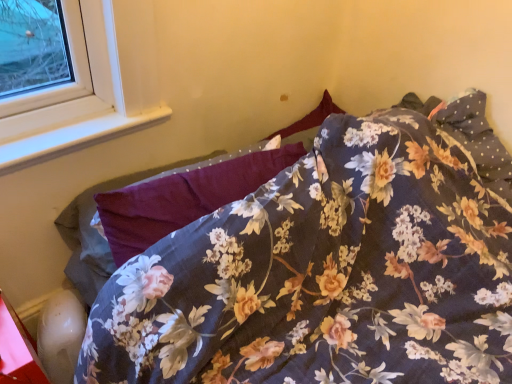
Question: Is white plastic window sill at upper left taller than floral fabric pillow at center?

Choices:
 (A) no
 (B) yes

Answer: (A)

Question: Does white plastic window sill at upper left have a larger size compared to floral fabric pillow at center?

Choices:
 (A) yes
 (B) no

Answer: (B)

Question: From the image's perspective, is white plastic window sill at upper left located above floral fabric pillow at center?

Choices:
 (A) no
 (B) yes

Answer: (B)

Question: Considering the relative positions of white plastic window sill at upper left and floral fabric pillow at center in the image provided, is white plastic window sill at upper left to the right of floral fabric pillow at center from the viewer's perspective?

Choices:
 (A) yes
 (B) no

Answer: (B)

Question: Is white plastic window sill at upper left in front of floral fabric pillow at center?

Choices:
 (A) yes
 (B) no

Answer: (B)

Question: Would you consider white plastic window sill at upper left to be distant from floral fabric pillow at center?

Choices:
 (A) yes
 (B) no

Answer: (B)

Question: Is floral fabric bed at center next to floral fabric pillow at center?

Choices:
 (A) no
 (B) yes

Answer: (A)

Question: Is floral fabric bed at center behind floral fabric pillow at center?

Choices:
 (A) no
 (B) yes

Answer: (A)

Question: From a real-world perspective, does floral fabric bed at center stand above floral fabric pillow at center?

Choices:
 (A) yes
 (B) no

Answer: (B)

Question: Considering the relative sizes of floral fabric bed at center and floral fabric pillow at center in the image provided, is floral fabric bed at center wider than floral fabric pillow at center?

Choices:
 (A) no
 (B) yes

Answer: (B)

Question: Could floral fabric pillow at center be considered to be inside floral fabric bed at center?

Choices:
 (A) yes
 (B) no

Answer: (A)

Question: Is floral fabric bed at center completely or partially outside of floral fabric pillow at center?

Choices:
 (A) no
 (B) yes

Answer: (B)

Question: Considering the relative positions of floral fabric pillow at center and floral fabric bed at center in the image provided, is floral fabric pillow at center to the right of floral fabric bed at center from the viewer's perspective?

Choices:
 (A) yes
 (B) no

Answer: (B)